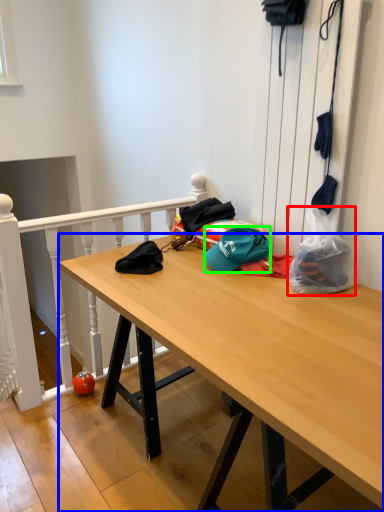
Question: Which object is positioned farthest from plastic bag (highlighted by a red box)? Select from desk (highlighted by a blue box) and hat (highlighted by a green box).

Choices:
 (A) desk
 (B) hat

Answer: (A)